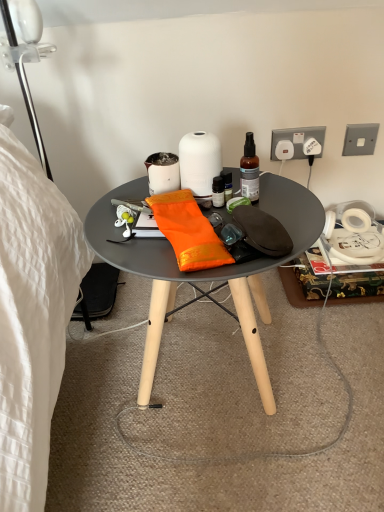
The height and width of the screenshot is (512, 384). Find the location of `spots to the right of white matte vase at center`. spots to the right of white matte vase at center is located at coordinates (275, 195).